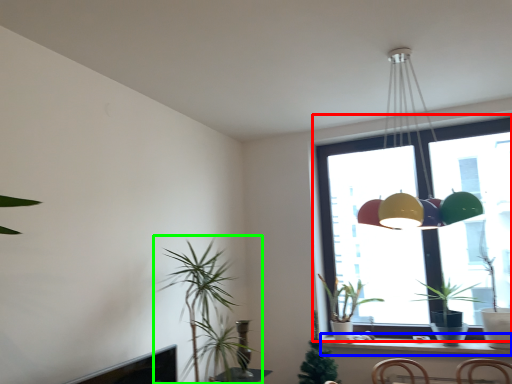
Question: Based on their relative distances, which object is farther from window (highlighted by a red box)? Choose from window sill (highlighted by a blue box) and houseplant (highlighted by a green box).

Choices:
 (A) window sill
 (B) houseplant

Answer: (B)